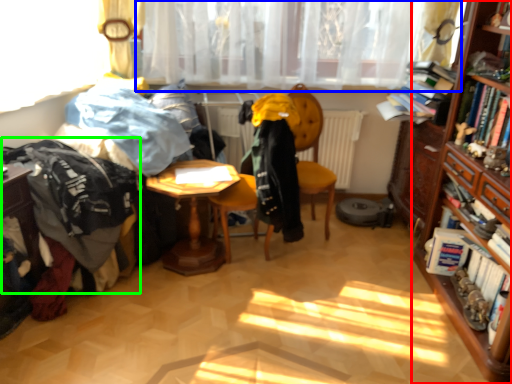
Question: Which object is the farthest from bookcase (highlighted by a red box)? Choose among these: curtain (highlighted by a blue box) or clothing (highlighted by a green box).

Choices:
 (A) curtain
 (B) clothing

Answer: (B)